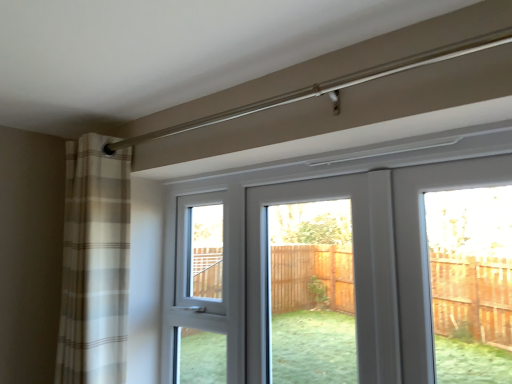
Question: In terms of height, does white glossy door at center look taller or shorter compared to white plastic screen door at center?

Choices:
 (A) short
 (B) tall

Answer: (A)

Question: Considering their positions, is white glossy door at center located in front of or behind white plastic screen door at center?

Choices:
 (A) behind
 (B) front

Answer: (B)

Question: Considering the real-world distances, which object is closest to the white glossy door at center?

Choices:
 (A) white plastic screen door at center
 (B) plaid fabric curtain at left

Answer: (A)

Question: Considering the real-world distances, which object is closest to the white plastic screen door at center?

Choices:
 (A) plaid fabric curtain at left
 (B) white glossy door at center

Answer: (A)